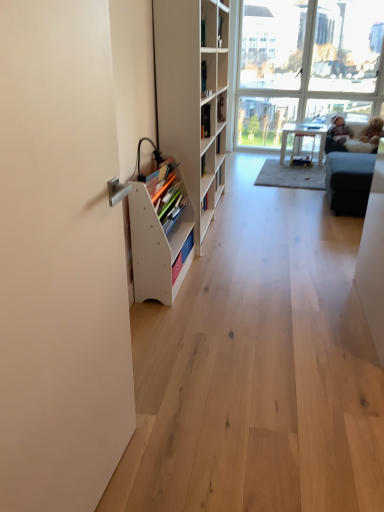
Question: Is dark gray fabric couch at upper right shorter than hardcover book at upper center, acting as the 2th book starting from the left?

Choices:
 (A) no
 (B) yes

Answer: (A)

Question: Would you say hardcover book at upper center, acting as the first book starting from the back, is part of dark gray fabric couch at upper right's contents?

Choices:
 (A) no
 (B) yes

Answer: (A)

Question: Is dark gray fabric couch at upper right with hardcover book at upper center, acting as the first book starting from the back?

Choices:
 (A) yes
 (B) no

Answer: (B)

Question: From a real-world perspective, is dark gray fabric couch at upper right on top of hardcover book at upper center, the first book from the right?

Choices:
 (A) yes
 (B) no

Answer: (B)

Question: Does dark gray fabric couch at upper right lie behind hardcover book at upper center, arranged as the second book when ordered from the bottom?

Choices:
 (A) yes
 (B) no

Answer: (A)

Question: Considering their positions, is white matte bookshelf at left, the 1th shelf in the top-to-bottom sequence, located in front of or behind white glossy table at center?

Choices:
 (A) front
 (B) behind

Answer: (A)

Question: Is white matte bookshelf at left, positioned as the 2th shelf in bottom-to-top order, situated inside white glossy table at center or outside?

Choices:
 (A) outside
 (B) inside

Answer: (A)

Question: In terms of height, does white matte bookshelf at left, positioned as the 2th shelf in bottom-to-top order, look taller or shorter compared to white glossy table at center?

Choices:
 (A) short
 (B) tall

Answer: (B)

Question: Would you say white matte bookshelf at left, positioned as the 2th shelf in bottom-to-top order, is to the left or to the right of white glossy table at center in the picture?

Choices:
 (A) right
 (B) left

Answer: (B)

Question: In terms of height, does light brown plush toy at upper right look taller or shorter compared to transparent glass window at upper right?

Choices:
 (A) short
 (B) tall

Answer: (A)

Question: From the image's perspective, is light brown plush toy at upper right located above or below transparent glass window at upper right?

Choices:
 (A) below
 (B) above

Answer: (A)

Question: In the image, is light brown plush toy at upper right positioned in front of or behind transparent glass window at upper right?

Choices:
 (A) behind
 (B) front

Answer: (A)

Question: Is point (342, 143) closer or farther from the camera than point (286, 31)?

Choices:
 (A) closer
 (B) farther

Answer: (A)

Question: From a real-world perspective, is hardcover book at upper center, acting as the 2th book starting from the left, physically located above or below transparent glass window at upper right?

Choices:
 (A) below
 (B) above

Answer: (B)

Question: In terms of height, does hardcover book at upper center, the second book in the front-to-back sequence, look taller or shorter compared to transparent glass window at upper right?

Choices:
 (A) tall
 (B) short

Answer: (B)